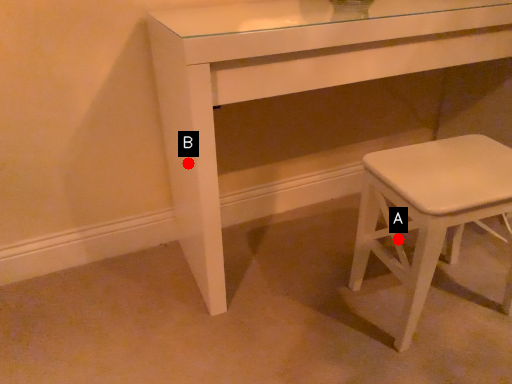
Question: Two points are circled on the image, labeled by A and B beside each circle. Which of the following is the farthest from the observer?

Choices:
 (A) A is further
 (B) B is further

Answer: (A)